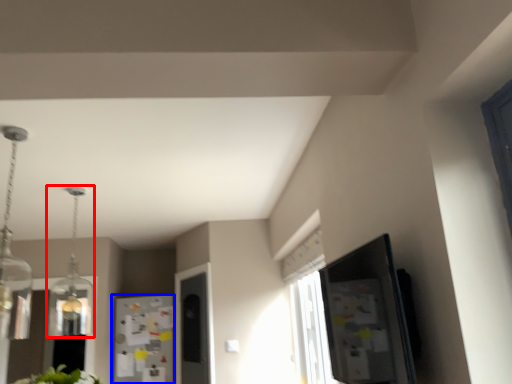
Question: Which of the following is the closest to the observer, light fixture (highlighted by a red box) or fridge (highlighted by a blue box)?

Choices:
 (A) light fixture
 (B) fridge

Answer: (A)